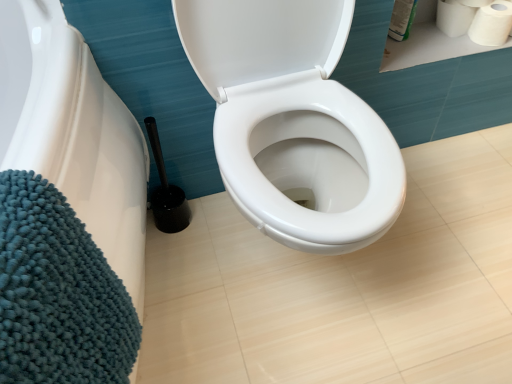
Locate an element on the screen. free space in front of black plastic toilet brush at lower left is located at coordinates (179, 261).